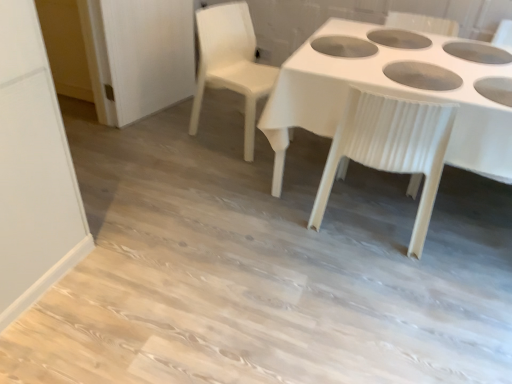
The width and height of the screenshot is (512, 384). I want to click on vacant space that is to the left of white plastic chair at upper center, the first chair from the left, so click(173, 140).